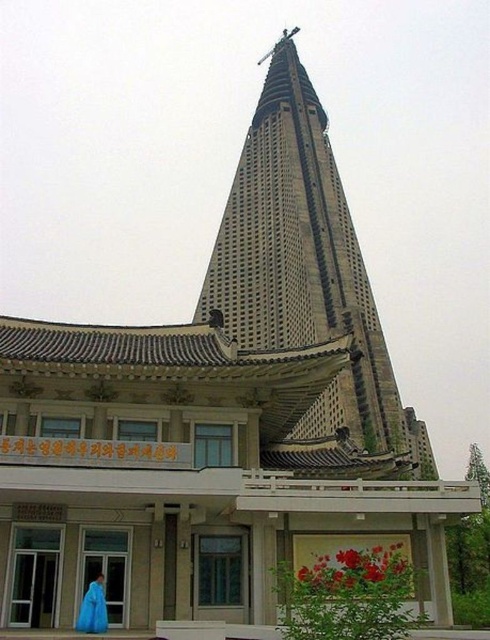
Question: Can you confirm if gray concrete tower at center is smaller than blue fabric at lower left?

Choices:
 (A) no
 (B) yes

Answer: (A)

Question: Among these points, which one is farthest from the camera?

Choices:
 (A) (94, 579)
 (B) (270, 115)

Answer: (B)

Question: Does gray concrete tower at center come in front of blue fabric at lower left?

Choices:
 (A) no
 (B) yes

Answer: (A)

Question: Which point is farther to the camera?

Choices:
 (A) gray concrete tower at center
 (B) blue fabric at lower left

Answer: (A)

Question: Is gray concrete tower at center further to the viewer compared to blue fabric at lower left?

Choices:
 (A) yes
 (B) no

Answer: (A)